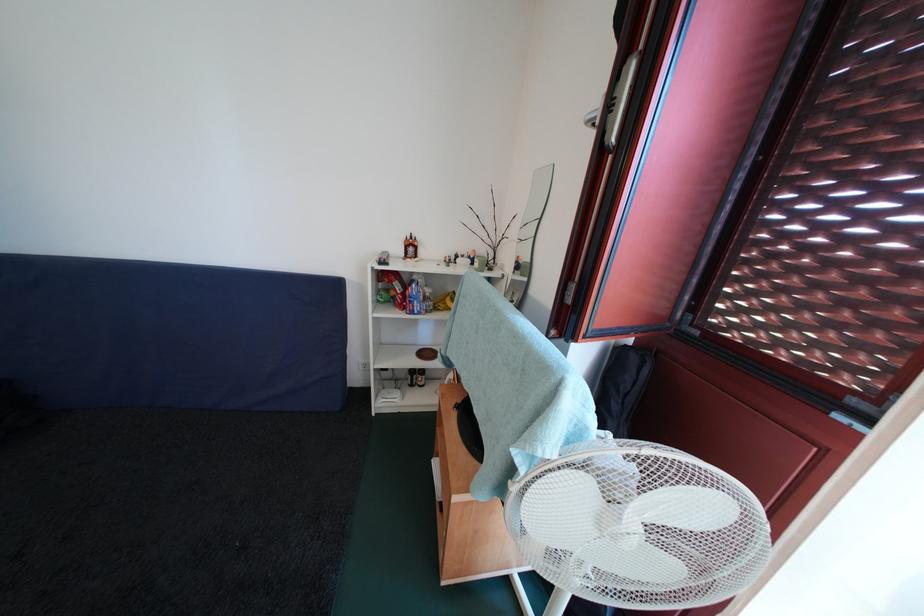
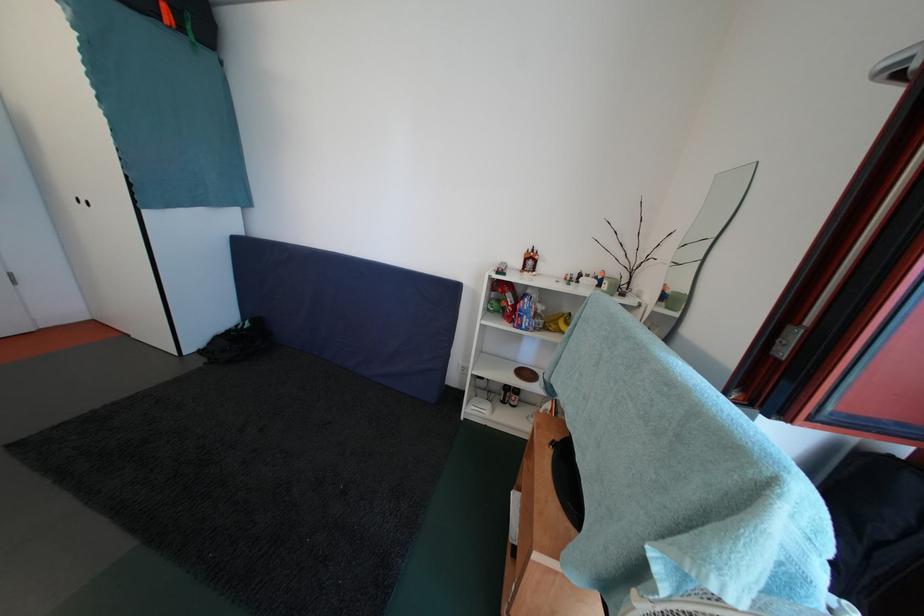
Question: Based on the continuous images, in which direction is the camera rotating? Reply with the corresponding letter.

Choices:
 (A) Left
 (B) Right
 (C) Up
 (D) Down

Answer: (A)